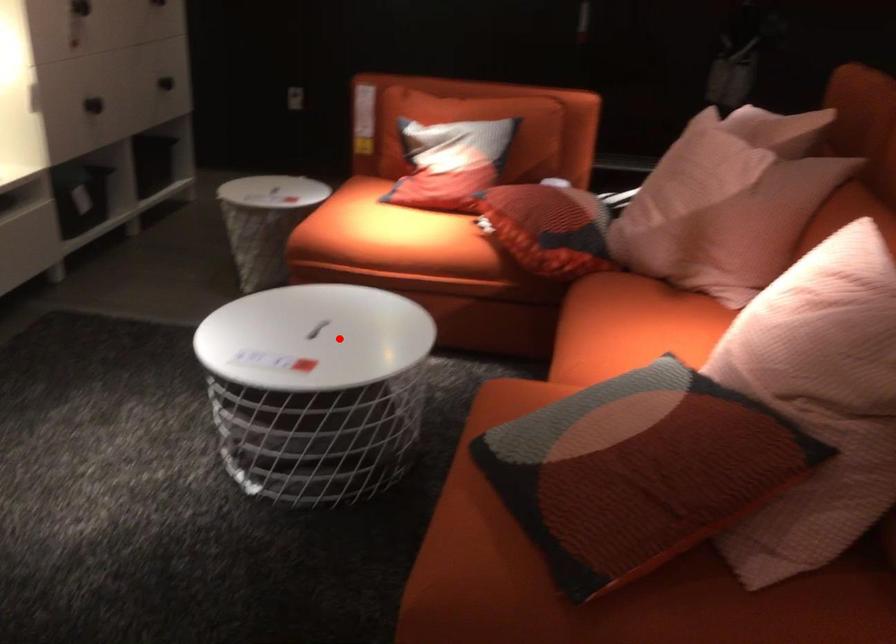
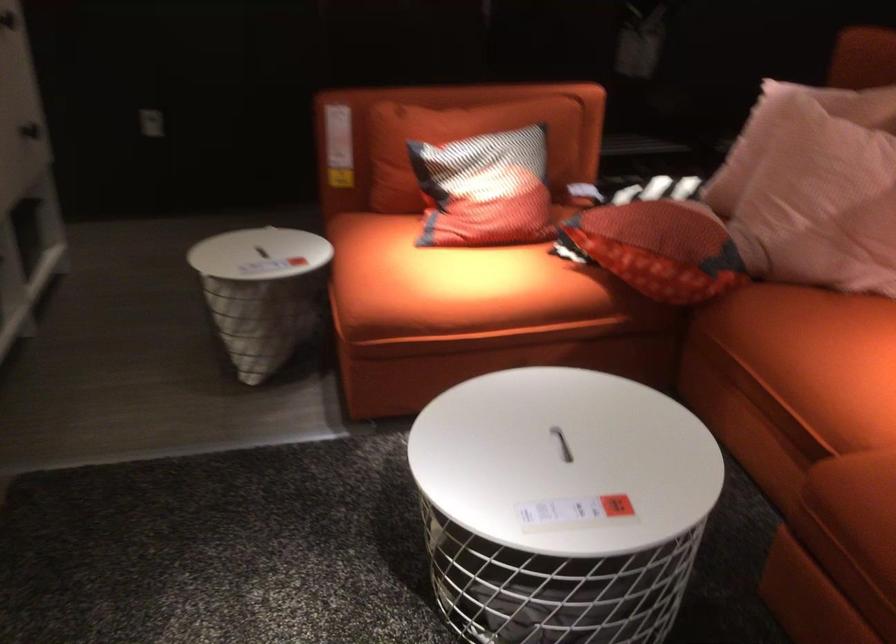
Question: I am providing you with two images of the same scene from different viewpoints. In image1, a red point is highlighted. Considering the same 3D point in image2, which of the following is correct?

Choices:
 (A) It is closer
 (B) It is farther

Answer: (A)